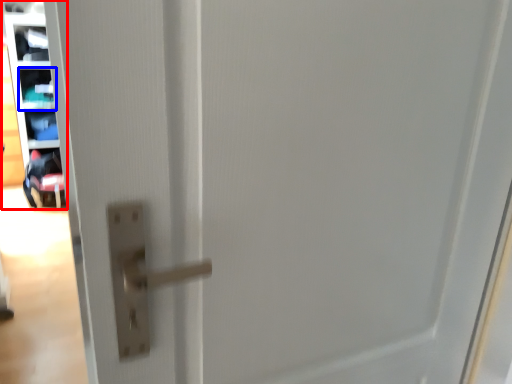
Question: Which of the following is the closest to the observer, shelf (highlighted by a red box) or shelf (highlighted by a blue box)?

Choices:
 (A) shelf
 (B) shelf

Answer: (A)